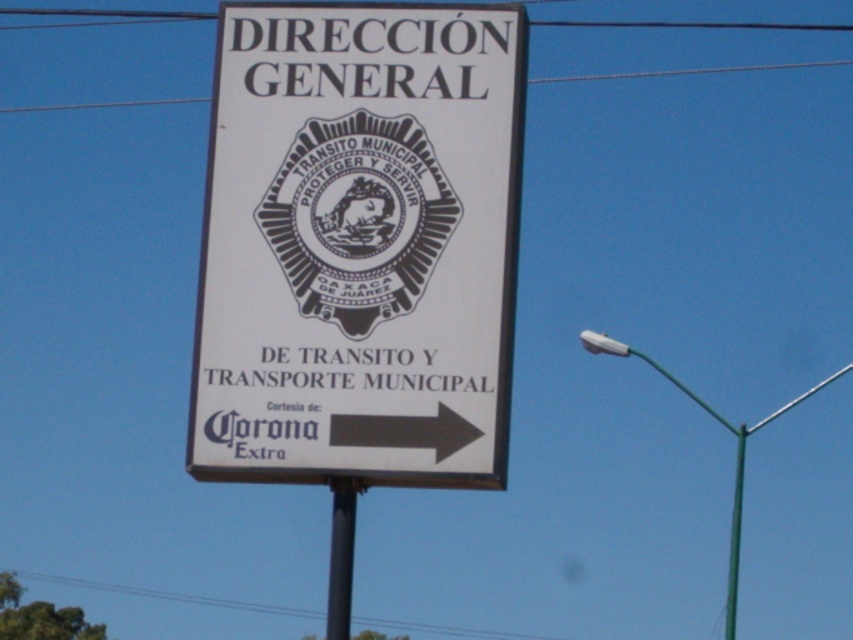
Does green metallic pole at right have a larger size compared to metallic pole at center?

Indeed, green metallic pole at right has a larger size compared to metallic pole at center.

Does green metallic pole at right come behind metallic pole at center?

Yes, green metallic pole at right is further from the viewer.

Is point (643, 355) behind point (344, 564)?

Yes, it is.

Find the location of a particular element. The width and height of the screenshot is (853, 640). green metallic pole at right is located at coordinates (735, 449).

Between point (374, 186) and point (160, 19), which one is positioned behind?

The point (160, 19) is more distant.

Is point (349, 20) farther from camera compared to point (822, 26)?

No, (349, 20) is in front of (822, 26).

Which is in front, point (465, 280) or point (115, 10)?

Point (465, 280)

Find the location of `white paper sign at center`. white paper sign at center is located at coordinates (358, 244).

Which is above, green metallic pole at right or metallic wire at upper center?

metallic wire at upper center is above.

Is green metallic pole at right closer to the viewer compared to metallic wire at upper center?

Yes, it is.

Who is more distant from viewer, (x=730, y=616) or (x=32, y=8)?

The point (x=32, y=8) is behind.

At what (x,y) coordinates should I click in order to perform the action: click on green metallic pole at right. Please return your answer as a coordinate pair (x, y). The height and width of the screenshot is (640, 853). Looking at the image, I should click on (735, 449).